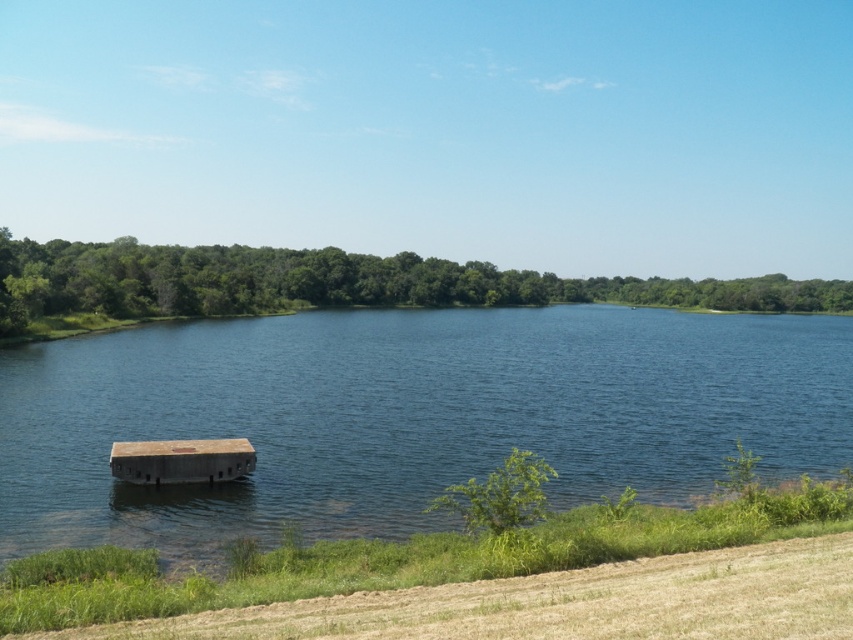
Question: Which object is closer to the camera taking this photo?

Choices:
 (A) brown wooden dock at center
 (B) clear blue water at center

Answer: (B)

Question: Does clear blue water at center have a lesser width compared to brown wooden dock at center?

Choices:
 (A) yes
 (B) no

Answer: (B)

Question: Among these points, which one is farthest from the camera?

Choices:
 (A) (247, 451)
 (B) (310, 486)

Answer: (A)

Question: Which point appears farthest from the camera in this image?

Choices:
 (A) (132, 452)
 (B) (720, 339)

Answer: (B)

Question: Does clear blue water at center appear under brown wooden dock at center?

Choices:
 (A) no
 (B) yes

Answer: (A)

Question: Considering the relative positions of clear blue water at center and brown wooden dock at center in the image provided, where is clear blue water at center located with respect to brown wooden dock at center?

Choices:
 (A) right
 (B) left

Answer: (A)